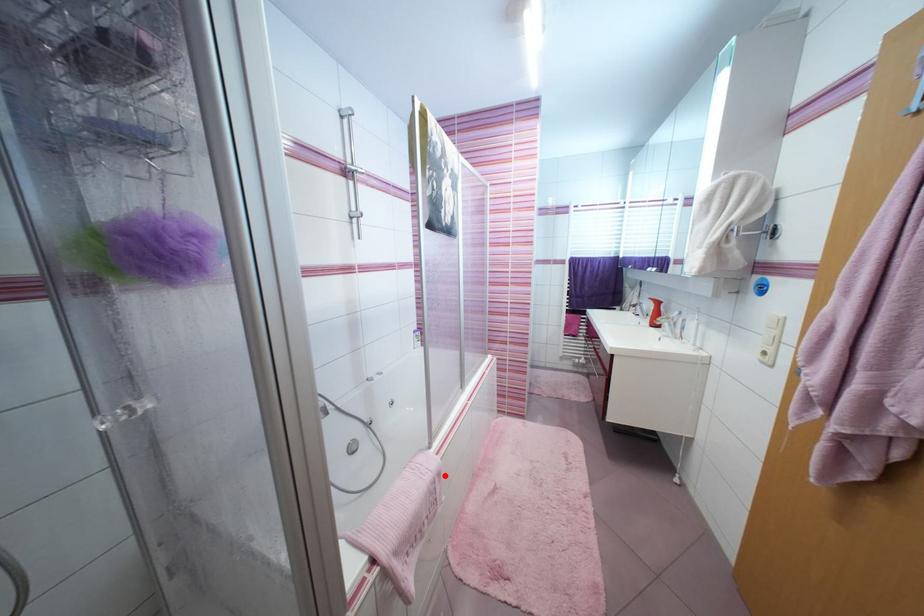
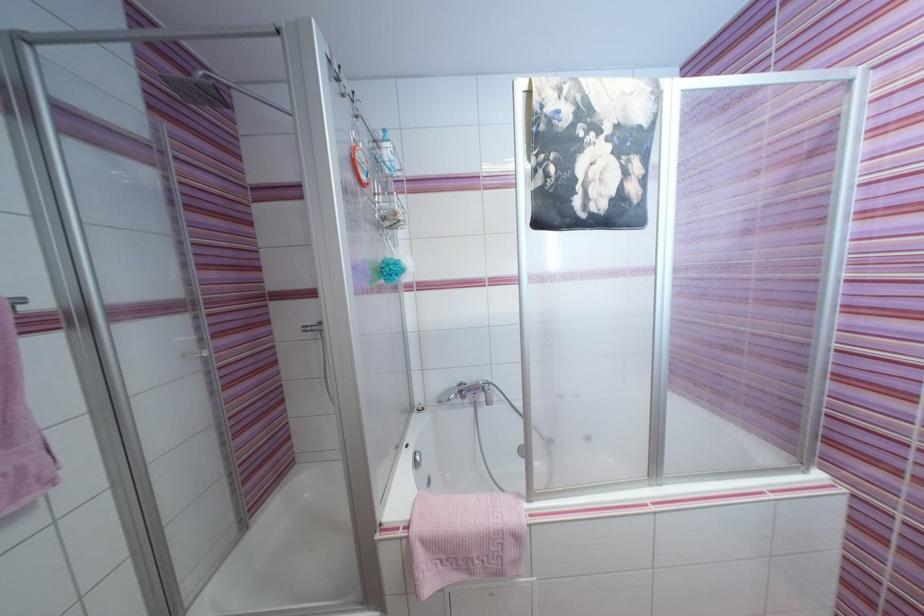
Find the pixel in the second image that matches the highlighted location in the first image.

(521, 539)